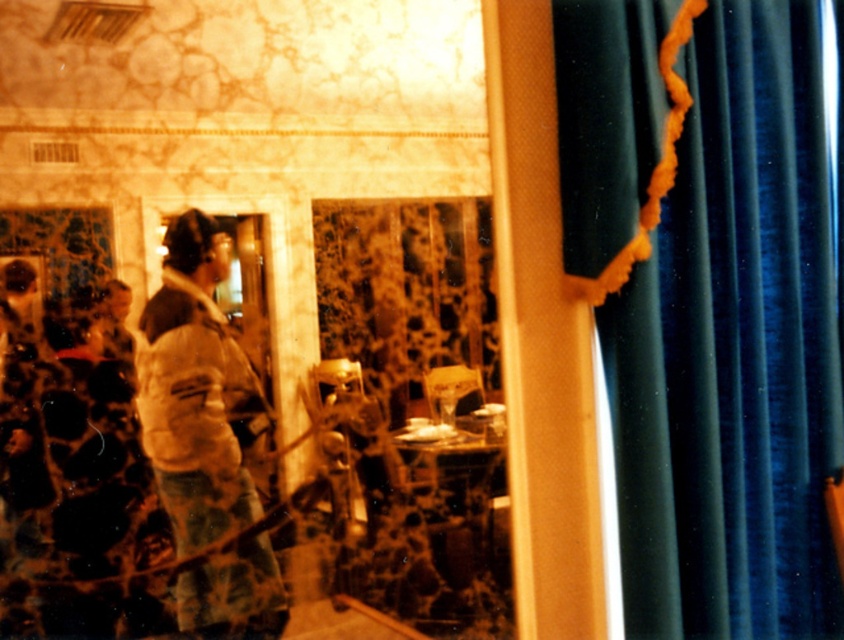
You are standing in the room and want to know if you can hang a small picture frame between the velvet blue curtain at right and the white fuzzy jacket at left. Which object is taller so that the frame can be placed above it?

The velvet blue curtain at right is taller than the white fuzzy jacket at left, so you can place the frame above the white fuzzy jacket at left.

You are a delivery person trying to place a small package on the floor between the velvet blue curtain at right and the white fuzzy jacket at left. Can you fit the package there if it measures 12 inches in length?

The velvet blue curtain at right is 29.94 inches away from the white fuzzy jacket at left. Since the package is only 12 inches long, there is enough space to place it between them.